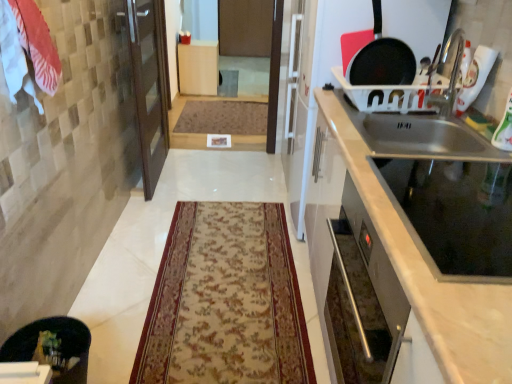
Where is `brown textured mat at center, the second mat in the bottom-to-top sequence`? brown textured mat at center, the second mat in the bottom-to-top sequence is located at coordinates (223, 117).

What do you see at coordinates (223, 117) in the screenshot?
I see `brown textured mat at center, marked as the second mat in a front-to-back arrangement` at bounding box center [223, 117].

Where is `black matte frying pan at upper right`? This screenshot has height=384, width=512. black matte frying pan at upper right is located at coordinates (382, 59).

You are a GUI agent. You are given a task and a screenshot of the screen. Output one action in this format:
    pyautogui.click(x=<x>, y=<y>)
    Task: Click on the matte wood cabinet at center, which appears as the 1th cabinetry when viewed from the left
    This screenshot has width=512, height=384.
    Given the screenshot: What is the action you would take?
    pyautogui.click(x=198, y=67)

This screenshot has width=512, height=384. Describe the element at coordinates (198, 67) in the screenshot. I see `matte wood cabinet at center, which appears as the 1th cabinetry when viewed from the left` at that location.

Identify the location of satin silver oven at right, which is the 1th cabinetry in front-to-back order. (419, 249).

Where is `white cotton towel at upper left`? The image size is (512, 384). white cotton towel at upper left is located at coordinates (27, 48).

Does point (364, 303) appear closer or farther from the camera than point (375, 61)?

Point (364, 303) appears to be closer to the viewer than point (375, 61).

From the image's perspective, which object appears higher, satin silver oven at right, marked as the 2th cabinetry in a top-to-bottom arrangement, or black matte frying pan at upper right?

black matte frying pan at upper right is shown above in the image.

Could black matte frying pan at upper right be considered to be inside satin silver oven at right, the 1th cabinetry when ordered from bottom to top?

No.

Is satin silver oven at right, the 1th cabinetry when ordered from bottom to top, to the left or to the right of black matte frying pan at upper right in the image?

satin silver oven at right, the 1th cabinetry when ordered from bottom to top, is positioned on black matte frying pan at upper right's right side.

Which object is positioned more to the left, satin silver oven at right, which ranks as the second cabinetry in back-to-front order, or white cotton towel at upper left?

Positioned to the left is white cotton towel at upper left.

Measure the distance from satin silver oven at right, marked as the 2th cabinetry in a top-to-bottom arrangement, to white cotton towel at upper left.

satin silver oven at right, marked as the 2th cabinetry in a top-to-bottom arrangement, is 1.15 meters away from white cotton towel at upper left.

Is satin silver oven at right, which is counted as the second cabinetry, starting from the left, far from white cotton towel at upper left?

Indeed, satin silver oven at right, which is counted as the second cabinetry, starting from the left, is not near white cotton towel at upper left.

From the picture: Is white cotton towel at upper left next to satin silver oven at right, which ranks as the second cabinetry in back-to-front order, and touching it?

white cotton towel at upper left is not next to satin silver oven at right, which ranks as the second cabinetry in back-to-front order, and they're not touching.

Based on the photo, can we say white cotton towel at upper left lies outside satin silver oven at right, which is the 1th cabinetry in front-to-back order?

white cotton towel at upper left is positioned outside satin silver oven at right, which is the 1th cabinetry in front-to-back order.

From a real-world perspective, does white cotton towel at upper left sit lower than satin silver oven at right, which is the 1th cabinetry in front-to-back order?

No.

Consider the image. Considering the relative sizes of white cotton towel at upper left and satin silver oven at right, which is the first cabinetry from right to left, in the image provided, is white cotton towel at upper left smaller than satin silver oven at right, which is the first cabinetry from right to left,?

Yes, white cotton towel at upper left is smaller than satin silver oven at right, which is the first cabinetry from right to left.

From the image's perspective, is satin silver oven at right, marked as the 2th cabinetry in a top-to-bottom arrangement, above or below beige floral rug at center, which is the 2th mat in top-to-bottom order?

Based on their image positions, satin silver oven at right, marked as the 2th cabinetry in a top-to-bottom arrangement, is located beneath beige floral rug at center, which is the 2th mat in top-to-bottom order.

From a real-world perspective, is satin silver oven at right, which is the first cabinetry from right to left, positioned over beige floral rug at center, arranged as the 1th mat when ordered from the bottom, based on gravity?

Yes, from a real-world perspective, satin silver oven at right, which is the first cabinetry from right to left, is over beige floral rug at center, arranged as the 1th mat when ordered from the bottom

Is point (397, 342) closer or farther from the camera than point (166, 268)?

Point (397, 342) is closer to the camera than point (166, 268).

Considering the positions of objects black matte frying pan at upper right and white cotton towel at upper left in the image provided, who is more to the right, black matte frying pan at upper right or white cotton towel at upper left?

black matte frying pan at upper right is more to the right.

You are a GUI agent. You are given a task and a screenshot of the screen. Output one action in this format:
    pyautogui.click(x=<x>, y=<y>)
    Task: Click on the laundry on the left of black matte frying pan at upper right
    The image size is (512, 384).
    Given the screenshot: What is the action you would take?
    pyautogui.click(x=27, y=48)

Which is in front, point (406, 75) or point (24, 38)?

Positioned in front is point (24, 38).

Which object is wider, black matte frying pan at upper right or white cotton towel at upper left?

white cotton towel at upper left.

The image size is (512, 384). Find the location of `cabinetry lying above the satin silver oven at right, which is counted as the second cabinetry, starting from the left (from the image's perspective)`. cabinetry lying above the satin silver oven at right, which is counted as the second cabinetry, starting from the left (from the image's perspective) is located at coordinates (198, 67).

Consider the image. From a real-world perspective, which is physically below, matte wood cabinet at center, the second cabinetry in the front-to-back sequence, or satin silver oven at right, which is the first cabinetry from right to left?

matte wood cabinet at center, the second cabinetry in the front-to-back sequence, from a real-world perspective.

From the picture: From the image's perspective, which is below, matte wood cabinet at center, which appears as the 1th cabinetry when viewed from the left, or satin silver oven at right, marked as the 2th cabinetry in a top-to-bottom arrangement?

From the image's view, satin silver oven at right, marked as the 2th cabinetry in a top-to-bottom arrangement, is below.

Is white cotton towel at upper left to the left or to the right of matte wood cabinet at center, which is counted as the second cabinetry, starting from the right, in the image?

Clearly, white cotton towel at upper left is on the left of matte wood cabinet at center, which is counted as the second cabinetry, starting from the right, in the image.

Is white cotton towel at upper left taller or shorter than matte wood cabinet at center, positioned as the 1th cabinetry in top-to-bottom order?

Considering their sizes, white cotton towel at upper left has less height than matte wood cabinet at center, positioned as the 1th cabinetry in top-to-bottom order.

Between white cotton towel at upper left and matte wood cabinet at center, which appears as the 1th cabinetry when viewed from the left, which one has larger size?

matte wood cabinet at center, which appears as the 1th cabinetry when viewed from the left.

From the image's perspective, who appears lower, white cotton towel at upper left or matte wood cabinet at center, the first cabinetry when ordered from back to front?

white cotton towel at upper left appears lower in the image.

Where is `frying pan to the left of satin silver oven at right, which is the first cabinetry from right to left`? This screenshot has height=384, width=512. frying pan to the left of satin silver oven at right, which is the first cabinetry from right to left is located at coordinates (382, 59).

Find the location of a particular element. The image size is (512, 384). cabinetry that is below the white cotton towel at upper left (from the image's perspective) is located at coordinates (419, 249).

From the image, which object appears to be farther from white cotton towel at upper left, beige floral rug at center, which is the 2th mat in top-to-bottom order, or brown textured mat at center, which is the 1th mat from back to front?

brown textured mat at center, which is the 1th mat from back to front.

In the scene shown: Estimate the real-world distances between objects in this image. Which object is further from brown textured mat at center, which is the 1th mat from back to front, beige floral rug at center, which is the 2th mat from back to front, or matte wood cabinet at center, which appears as the 1th cabinetry when viewed from the left?

beige floral rug at center, which is the 2th mat from back to front, is positioned further to the anchor brown textured mat at center, which is the 1th mat from back to front.

Based on their spatial positions, is satin silver oven at right, the 1th cabinetry when ordered from bottom to top, or matte wood cabinet at center, which is counted as the second cabinetry, starting from the right, further from white cotton towel at upper left?

Based on the image, matte wood cabinet at center, which is counted as the second cabinetry, starting from the right, appears to be further to white cotton towel at upper left.

Estimate the real-world distances between objects in this image. Which object is closer to white cotton towel at upper left, brown textured mat at center, marked as the second mat in a front-to-back arrangement, or matte wood cabinet at center, the 2th cabinetry positioned from the bottom?

brown textured mat at center, marked as the second mat in a front-to-back arrangement, is closer to white cotton towel at upper left.

Looking at the image, which one is located further to beige floral rug at center, marked as the 1th mat in a front-to-back arrangement, matte wood cabinet at center, the second cabinetry in the front-to-back sequence, or brown textured mat at center, the second mat in the bottom-to-top sequence?

Among the two, matte wood cabinet at center, the second cabinetry in the front-to-back sequence, is located further to beige floral rug at center, marked as the 1th mat in a front-to-back arrangement.

Estimate the real-world distances between objects in this image. Which object is closer to beige floral rug at center, which is the 2th mat in top-to-bottom order, matte wood cabinet at center, the first cabinetry when ordered from back to front, or black matte frying pan at upper right?

Among the two, black matte frying pan at upper right is located nearer to beige floral rug at center, which is the 2th mat in top-to-bottom order.

Estimate the real-world distances between objects in this image. Which object is further from brown textured mat at center, the second mat in the bottom-to-top sequence, white cotton towel at upper left or matte wood cabinet at center, the first cabinetry when ordered from back to front?

The object further to brown textured mat at center, the second mat in the bottom-to-top sequence, is white cotton towel at upper left.

Looking at the image, which one is located further to satin silver oven at right, which is the first cabinetry from right to left, brown textured mat at center, marked as the second mat in a front-to-back arrangement, or white cotton towel at upper left?

brown textured mat at center, marked as the second mat in a front-to-back arrangement, is positioned further to the anchor satin silver oven at right, which is the first cabinetry from right to left.

Where is `mat between black matte frying pan at upper right and satin silver oven at right, the 1th cabinetry when ordered from bottom to top, in the up-down direction`? Image resolution: width=512 pixels, height=384 pixels. mat between black matte frying pan at upper right and satin silver oven at right, the 1th cabinetry when ordered from bottom to top, in the up-down direction is located at coordinates (225, 301).

This screenshot has width=512, height=384. I want to click on frying pan positioned between satin silver oven at right, the 1th cabinetry when ordered from bottom to top, and brown textured mat at center, marked as the second mat in a front-to-back arrangement, from near to far, so click(x=382, y=59).

Find the location of a particular element. mat positioned between white cotton towel at upper left and brown textured mat at center, which ranks as the first mat in top-to-bottom order, from near to far is located at coordinates (225, 301).

This screenshot has width=512, height=384. In order to click on laundry between satin silver oven at right, which is counted as the second cabinetry, starting from the left, and matte wood cabinet at center, the first cabinetry when ordered from back to front, from front to back in this screenshot , I will do `click(27, 48)`.